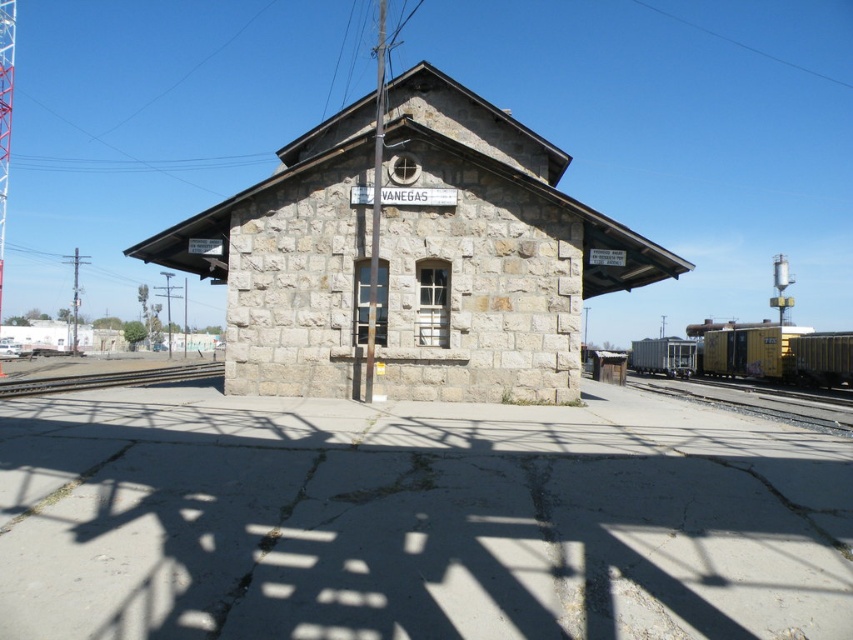
You are a toy train operator who needs to move a toy train from the brown wooden train track at lower left to the smooth yellow track at right. Considering the height difference between them, will the train be able to move smoothly without any assistance?

The smooth yellow track at right has a greater height compared to the brown wooden train track at lower left. The train will need assistance to move up to the higher track since there is a height difference between them.

You are a photographer wanting to capture the stone railway station at center and the yellow painted metal train car at right in the same frame. Which object should you focus on first to ensure both are in the frame?

The stone railway station at center is much taller than the yellow painted metal train car at right, so you should focus on the stone railway station at center first to ensure both are in the frame.